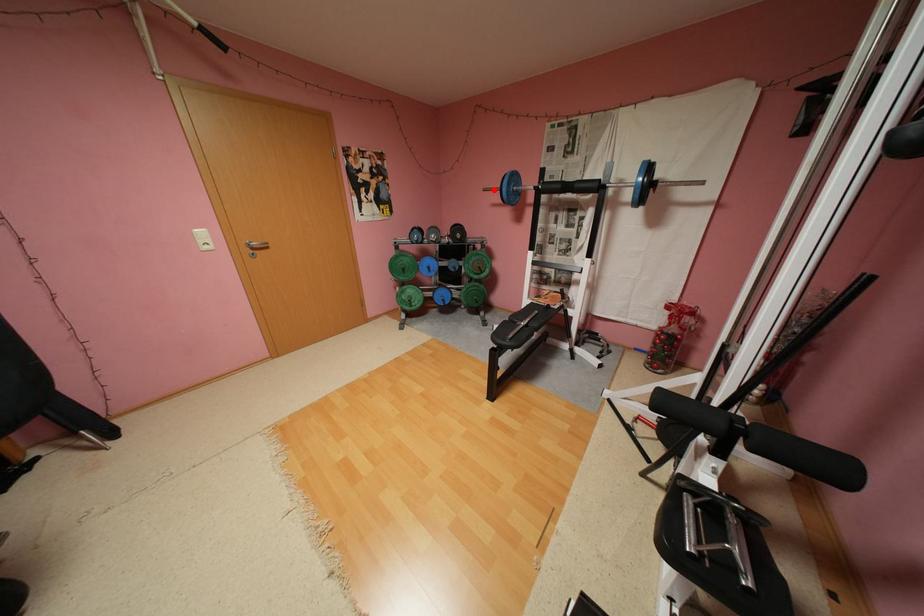
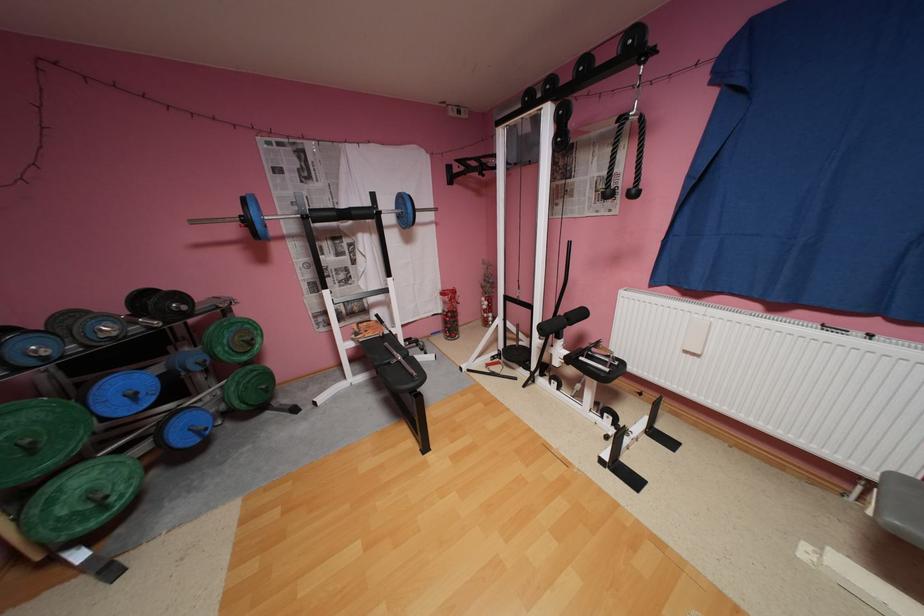
Question: I am providing you with two images of the same scene from different viewpoints. A red point is shown in image1. For the corresponding object point in image2, is it positioned nearer or farther from the camera?

Choices:
 (A) Nearer
 (B) Farther

Answer: (B)